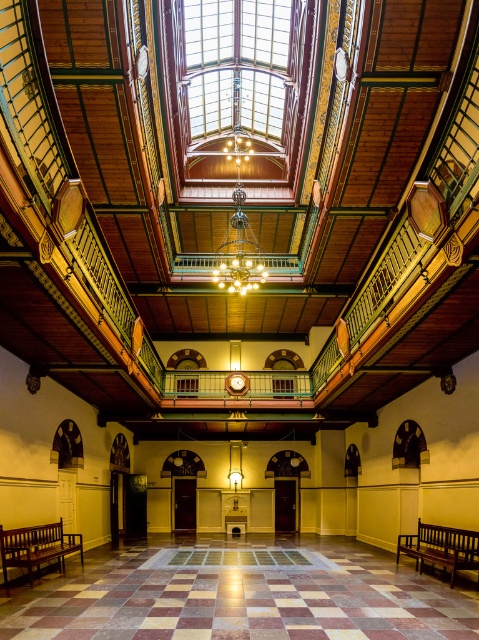
Question: Is marble tile floor at center thinner than wooden bench at lower left?

Choices:
 (A) no
 (B) yes

Answer: (A)

Question: Which object is positioned farthest from the marble tile floor at center?

Choices:
 (A) dark brown wooden bench at lower right
 (B) wooden bench at lower left

Answer: (A)

Question: Estimate the real-world distances between objects in this image. Which object is farther from the dark brown wooden bench at lower right?

Choices:
 (A) marble tile floor at center
 (B) wooden bench at lower left

Answer: (B)

Question: Which object is the closest to the wooden bench at lower left?

Choices:
 (A) marble tile floor at center
 (B) dark brown wooden bench at lower right

Answer: (A)

Question: Does marble tile floor at center appear on the right side of dark brown wooden bench at lower right?

Choices:
 (A) no
 (B) yes

Answer: (A)

Question: Is marble tile floor at center further to camera compared to wooden bench at lower left?

Choices:
 (A) yes
 (B) no

Answer: (B)